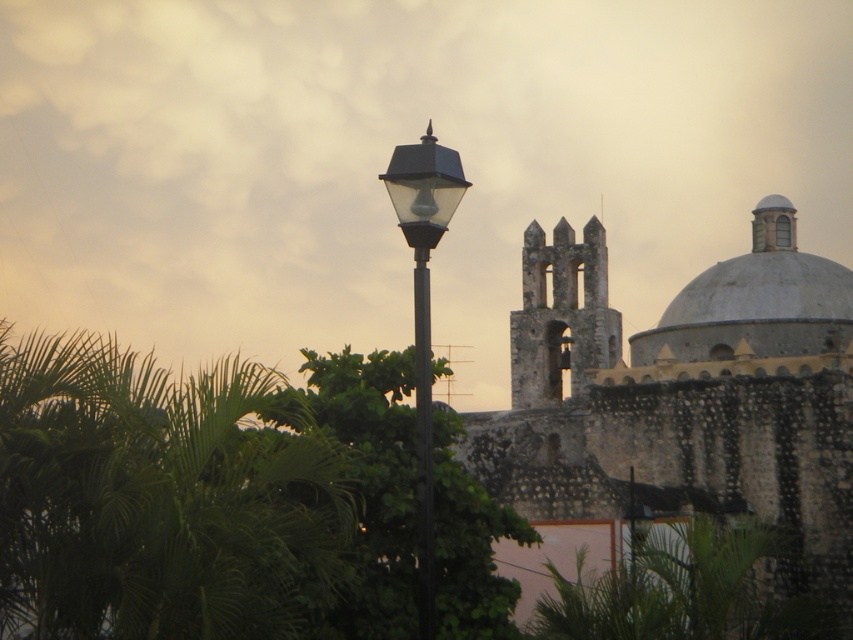
Question: Considering the relative positions of stone dome at center and black metal pole at center in the image provided, where is stone dome at center located with respect to black metal pole at center?

Choices:
 (A) above
 (B) below

Answer: (B)

Question: Which of the following is the closest to the observer?

Choices:
 (A) green leafy tree at center
 (B) stone tower at center

Answer: (A)

Question: Considering the relative positions of white smooth dome at upper right and black metal pole at center in the image provided, where is white smooth dome at upper right located with respect to black metal pole at center?

Choices:
 (A) below
 (B) above

Answer: (B)

Question: Does white smooth dome at upper right have a lesser width compared to matte black street light at center?

Choices:
 (A) yes
 (B) no

Answer: (B)

Question: Estimate the real-world distances between objects in this image. Which object is farther from the white smooth dome at upper right?

Choices:
 (A) green leafy tree at center
 (B) black metal pole at center

Answer: (B)

Question: Which of these objects is positioned farthest from the cloudy sky at upper center?

Choices:
 (A) white smooth dome at upper right
 (B) matte black street light at center
 (C) black metal pole at center

Answer: (A)